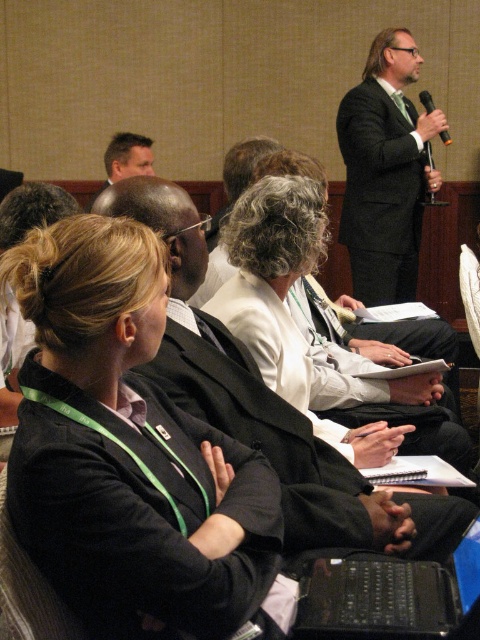
You are standing in the conference room and want to reach the point marked as point (32, 253). If your height is 1.7 meters, will you be able to see the speaker at the front right of the frame over the seated audience?

The point marked as point (32, 253) is 1.02 meters away from the viewer. Since the speaker is positioned at the front right of the frame and the audience is seated, the viewer should have a clear line of sight to the speaker unless there are obstacles. The distance alone does not indicate obstruction, so yes, you can likely see the speaker.